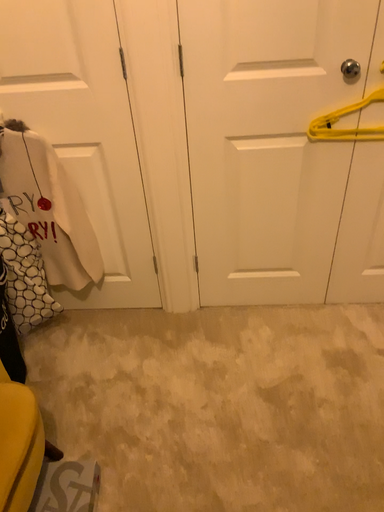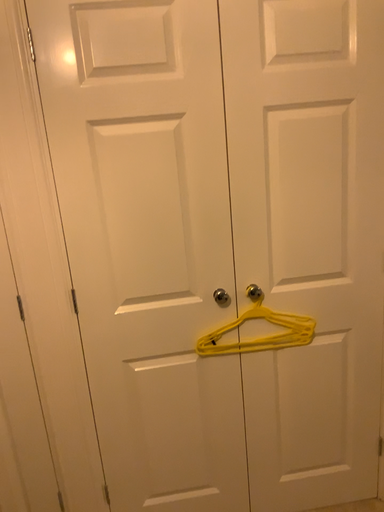
Question: Which way did the camera rotate in the video?

Choices:
 (A) rotated upward
 (B) rotated downward

Answer: (A)